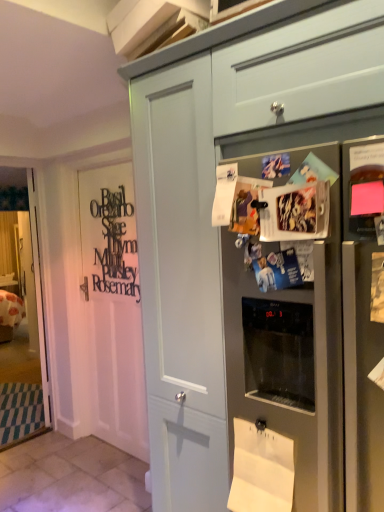
Image resolution: width=384 pixels, height=512 pixels. What do you see at coordinates (301, 69) in the screenshot?
I see `matte gray drawer at upper center` at bounding box center [301, 69].

What do you see at coordinates (27, 328) in the screenshot?
I see `clear glass door at left` at bounding box center [27, 328].

Measure the distance between point (173, 362) and camera.

Point (173, 362) and camera are 1.66 meters apart from each other.

Describe the element at coordinates (252, 247) in the screenshot. The height and width of the screenshot is (512, 384). I see `matte gray cabinet at center` at that location.

Describe the element at coordinates (112, 243) in the screenshot. This screenshot has height=512, width=384. I see `black wood sign at left` at that location.

Consider the image. In order to face black wood sign at left, should I rotate leftwards or rightwards?

To face it directly, rotate left by 10.607 degrees.

The width and height of the screenshot is (384, 512). Find the location of `matte gray drawer at upper center`. matte gray drawer at upper center is located at coordinates pos(301,69).

Is black wood sign at left next to white paper at lower center and touching it?

black wood sign at left and white paper at lower center are clearly separated.

Considering the points (95, 288) and (273, 438), which point is in front, point (95, 288) or point (273, 438)?

The point (273, 438) is closer to the camera.

From the image's perspective, is black wood sign at left located beneath white paper at lower center?

No, from the image's perspective, black wood sign at left is not beneath white paper at lower center.

Can you tell me how much black wood sign at left and white paper at lower center differ in facing direction?

They differ by 1.53 degrees in their facing directions.

Is clear glass door at left positioned far away from satin silver refrigerator at upper right?

Absolutely, clear glass door at left is distant from satin silver refrigerator at upper right.

Considering the relative sizes of clear glass door at left and satin silver refrigerator at upper right in the image provided, is clear glass door at left wider than satin silver refrigerator at upper right?

Incorrect, the width of clear glass door at left does not surpass that of satin silver refrigerator at upper right.

From their relative heights in the image, would you say clear glass door at left is taller or shorter than satin silver refrigerator at upper right?

In the image, clear glass door at left appears to be taller than satin silver refrigerator at upper right.

Is point (24, 357) more distant than point (339, 182)?

Yes.

Could you tell me if clear glass door at left is turned towards white paper at lower center?

Yes, clear glass door at left is oriented towards white paper at lower center.

Measure the distance between clear glass door at left and white paper at lower center.

clear glass door at left is 9.09 feet from white paper at lower center.

From the image's perspective, is clear glass door at left above or below white paper at lower center?

clear glass door at left is situated higher than white paper at lower center in the image.

Which of these two, clear glass door at left or white paper at lower center, is bigger?

With larger size is clear glass door at left.

Is black wood sign at left aimed at clear glass door at left?

No, black wood sign at left is not facing towards clear glass door at left.

Is black wood sign at left positioned far away from clear glass door at left?

black wood sign at left is positioned a significant distance from clear glass door at left.

Is black wood sign at left outside of clear glass door at left?

Yes, black wood sign at left is located beyond the bounds of clear glass door at left.

Considering the positions of point (132, 252) and point (22, 431), is point (132, 252) closer or farther from the camera than point (22, 431)?

Point (132, 252) is closer to the camera than point (22, 431).

In terms of height, does matte gray drawer at upper center look taller or shorter compared to matte gray cabinet at center?

In the image, matte gray drawer at upper center appears to be shorter than matte gray cabinet at center.

Is matte gray drawer at upper center looking in the opposite direction of matte gray cabinet at center?

matte gray drawer at upper center is not turned away from matte gray cabinet at center.

From a real-world perspective, who is located lower, matte gray drawer at upper center or matte gray cabinet at center?

From a 3D spatial view, matte gray cabinet at center is below.

Which object is positioned more to the right, matte gray drawer at upper center or matte gray cabinet at center?

matte gray drawer at upper center is more to the right.

Is matte gray drawer at upper center facing away from black wood sign at left?

No, matte gray drawer at upper center's orientation is not away from black wood sign at left.

Based on the photo, between matte gray drawer at upper center and black wood sign at left, which one is positioned behind?

black wood sign at left.

Are matte gray drawer at upper center and black wood sign at left making contact?

No, matte gray drawer at upper center is not making contact with black wood sign at left.

Considering the relative sizes of matte gray drawer at upper center and black wood sign at left in the image provided, is matte gray drawer at upper center smaller than black wood sign at left?

No.

Does satin silver refrigerator at upper right have a greater height compared to matte gray cabinet at center?

In fact, satin silver refrigerator at upper right may be shorter than matte gray cabinet at center.

In order to click on cabinetry lying in front of the satin silver refrigerator at upper right in this screenshot , I will do `click(252, 247)`.

Does point (258, 505) come behind point (356, 91)?

Yes, point (258, 505) is behind point (356, 91).

Can you confirm if satin silver refrigerator at upper right is positioned to the left of matte gray cabinet at center?

Yes.

The image size is (384, 512). Find the location of `toilet paper in front of the black wood sign at left`. toilet paper in front of the black wood sign at left is located at coordinates [261, 470].

The width and height of the screenshot is (384, 512). In order to click on glass door that appears below the satin silver refrigerator at upper right (from the image's perspective) in this screenshot , I will do `click(27, 328)`.

Considering their positions, is matte gray drawer at upper center positioned closer to matte gray cabinet at center than clear glass door at left?

Based on the image, matte gray drawer at upper center appears to be nearer to matte gray cabinet at center.

Considering their positions, is black wood sign at left positioned further to matte gray drawer at upper center than white paper at lower center?

Based on the image, black wood sign at left appears to be further to matte gray drawer at upper center.

Based on their spatial positions, is matte gray drawer at upper center or black wood sign at left closer to satin silver refrigerator at upper right?

matte gray drawer at upper center is positioned closer to the anchor satin silver refrigerator at upper right.

Based on their spatial positions, is matte gray cabinet at center or black wood sign at left further from clear glass door at left?

matte gray cabinet at center lies further to clear glass door at left than the other object.

From the image, which object appears to be farther from clear glass door at left, satin silver refrigerator at upper right or black wood sign at left?

Based on the image, satin silver refrigerator at upper right appears to be further to clear glass door at left.

Which object lies further to the anchor point white paper at lower center, matte gray cabinet at center or clear glass door at left?

Among the two, clear glass door at left is located further to white paper at lower center.

From the image, which object appears to be farther from white paper at lower center, black wood sign at left or white wood door at left?

white wood door at left is further to white paper at lower center.

Based on the photo, looking at the image, which one is located further to white paper at lower center, matte gray drawer at upper center or satin silver refrigerator at upper right?

matte gray drawer at upper center lies further to white paper at lower center than the other object.

Locate an element on the screen. Image resolution: width=384 pixels, height=512 pixels. glass door between white paper at lower center and white wood door at left along the z-axis is located at coordinates (27, 328).

Where is `signature between white paper at lower center and white wood door at left in the front-back direction`? The height and width of the screenshot is (512, 384). signature between white paper at lower center and white wood door at left in the front-back direction is located at coordinates (112, 243).

The height and width of the screenshot is (512, 384). In order to click on signature between matte gray cabinet at center and clear glass door at left from front to back in this screenshot , I will do `click(112, 243)`.

Where is `toilet paper positioned between matte gray cabinet at center and white wood door at left from near to far`? Image resolution: width=384 pixels, height=512 pixels. toilet paper positioned between matte gray cabinet at center and white wood door at left from near to far is located at coordinates (261, 470).